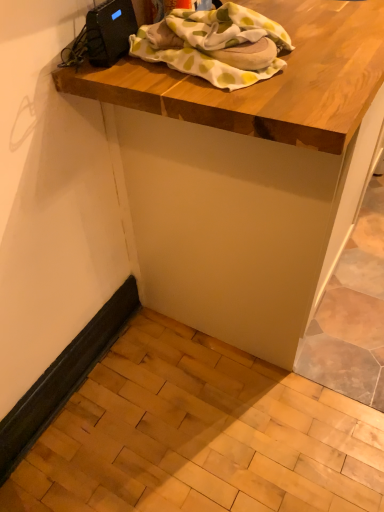
Question: Can you confirm if white cotton blanket at upper center is shorter than wooden table at upper center?

Choices:
 (A) yes
 (B) no

Answer: (A)

Question: Does white cotton blanket at upper center come behind wooden table at upper center?

Choices:
 (A) yes
 (B) no

Answer: (A)

Question: Is white cotton blanket at upper center aimed at wooden table at upper center?

Choices:
 (A) no
 (B) yes

Answer: (A)

Question: Can you confirm if white cotton blanket at upper center is wider than wooden table at upper center?

Choices:
 (A) yes
 (B) no

Answer: (B)

Question: Can you confirm if white cotton blanket at upper center is positioned to the right of wooden table at upper center?

Choices:
 (A) no
 (B) yes

Answer: (A)

Question: Is white cotton blanket at upper center taller than wooden table at upper center?

Choices:
 (A) yes
 (B) no

Answer: (B)

Question: Is white cotton blanket at upper center inside wooden table at upper center?

Choices:
 (A) no
 (B) yes

Answer: (A)

Question: Considering the relative positions of wooden table at upper center and white cotton blanket at upper center in the image provided, is wooden table at upper center to the left of white cotton blanket at upper center from the viewer's perspective?

Choices:
 (A) yes
 (B) no

Answer: (B)

Question: Are wooden table at upper center and white cotton blanket at upper center beside each other?

Choices:
 (A) yes
 (B) no

Answer: (B)

Question: Does wooden table at upper center have a lesser height compared to white cotton blanket at upper center?

Choices:
 (A) yes
 (B) no

Answer: (B)

Question: From the image's perspective, is wooden table at upper center above white cotton blanket at upper center?

Choices:
 (A) no
 (B) yes

Answer: (B)

Question: From a real-world perspective, is wooden table at upper center over white cotton blanket at upper center?

Choices:
 (A) yes
 (B) no

Answer: (B)

Question: Considering the positions of point click(155, 266) and point click(289, 39), is point click(155, 266) closer or farther from the camera than point click(289, 39)?

Choices:
 (A) closer
 (B) farther

Answer: (B)